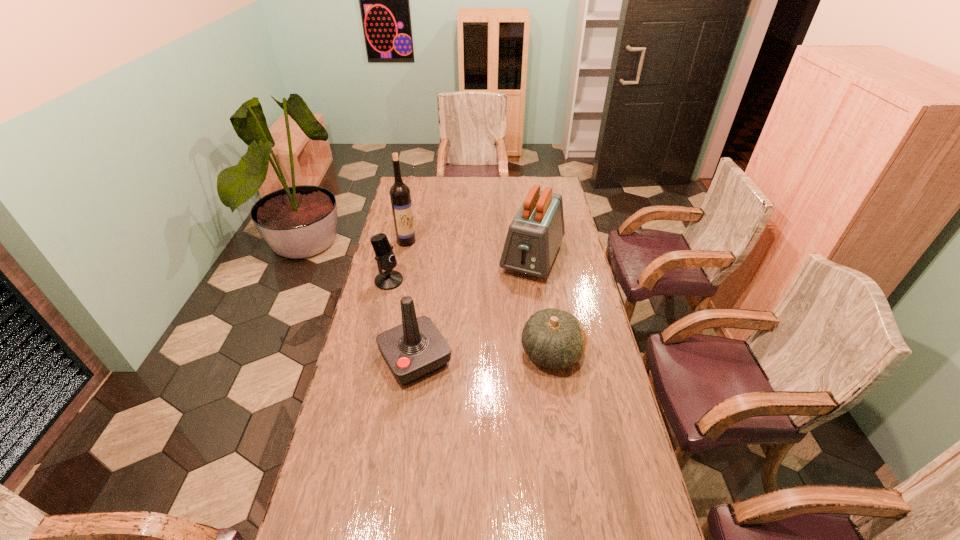
Image resolution: width=960 pixels, height=540 pixels. What are the coordinates of `empty location between the toaster and the tallest object` in the screenshot? It's located at (469, 249).

Find the location of a particular element. vacant region between the wine bottle and the toaster is located at coordinates (469, 249).

This screenshot has height=540, width=960. Find the location of `free spot between the joystick and the shortest object`. free spot between the joystick and the shortest object is located at coordinates (484, 356).

Identify the location of object that is the second closest to the toaster. (416, 348).

Identify which object is located as the third nearest to the joystick. Please provide its 2D coordinates. Your answer should be formatted as a tuple, i.e. [(x, y)], where the tuple contains the x and y coordinates of a point satisfying the conditions above.

[(534, 236)]

What are the coordinates of `free location that satisfies the following two spatial constraints: 1. on the back side of the toaster; 2. on the right side of the microphone` in the screenshot? It's located at (395, 258).

Where is `free space that satisfies the following two spatial constraints: 1. on the front side of the wine bottle; 2. on the left side of the toaster`? This screenshot has width=960, height=540. free space that satisfies the following two spatial constraints: 1. on the front side of the wine bottle; 2. on the left side of the toaster is located at coordinates (403, 258).

Locate an element on the screen. The image size is (960, 540). vacant point that satisfies the following two spatial constraints: 1. on the back side of the microphone; 2. on the right side of the toaster is located at coordinates (395, 258).